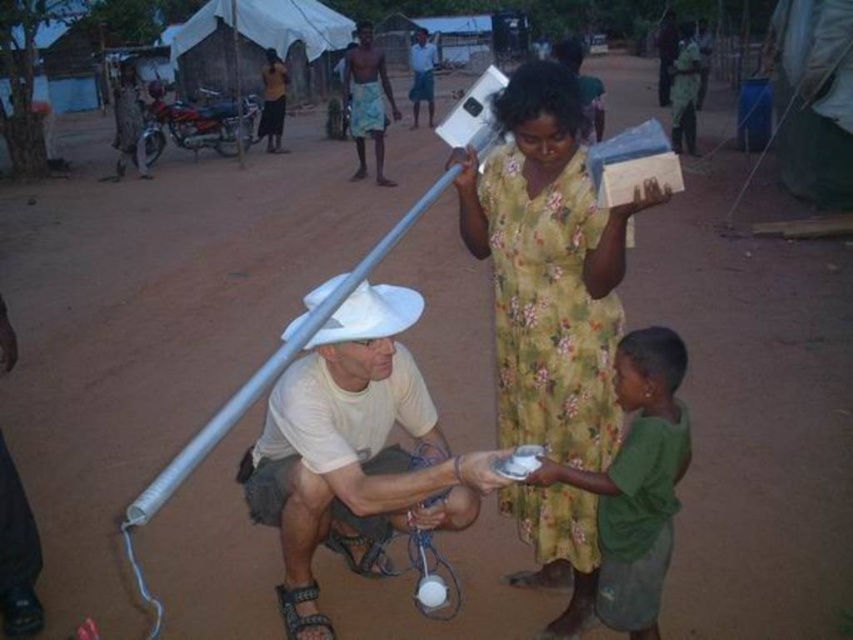
You are standing at point (x=357, y=160) and want to walk to the man with the metallic pole. Which direction should you go relative to point (x=561, y=481)?

You should walk towards point (x=561, y=481), which is in front of point (x=357, y=160), so the direction is forward.

You are standing at the camera position and want to hand a small toy to the green cotton shirt at lower right. Can you reach them without moving your position?

The distance between you and the green cotton shirt at lower right is 7.14 feet, which is approximately 85.68 inches. Since the average human arm length is about 25 to 35 inches, you cannot reach them without moving closer.